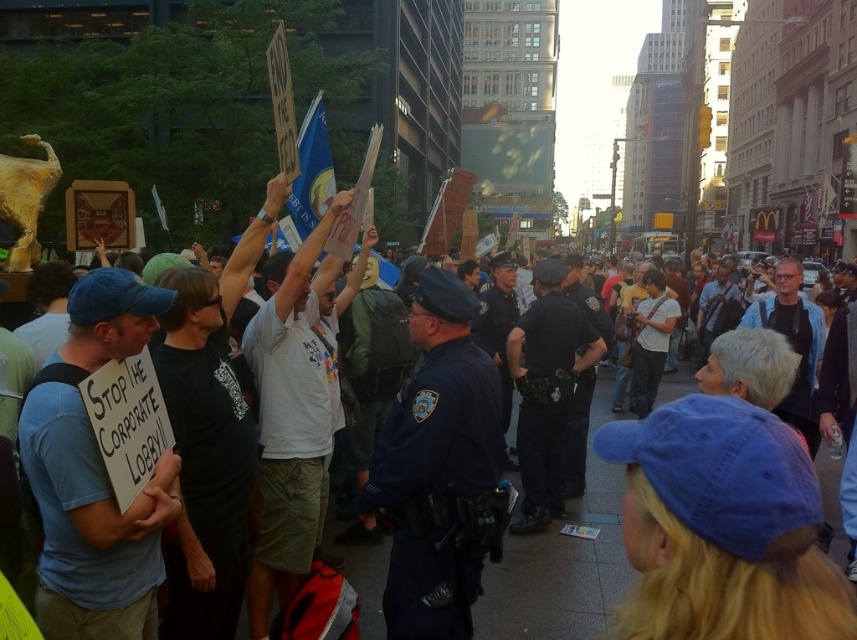
Can you confirm if blue uniformed officer at center is positioned below dark blue uniform at center?

Correct, blue uniformed officer at center is located below dark blue uniform at center.

Between point (451, 618) and point (537, 492), which one is positioned in front?

Point (451, 618)

This screenshot has width=857, height=640. I want to click on blue uniformed officer at center, so click(x=436, y=467).